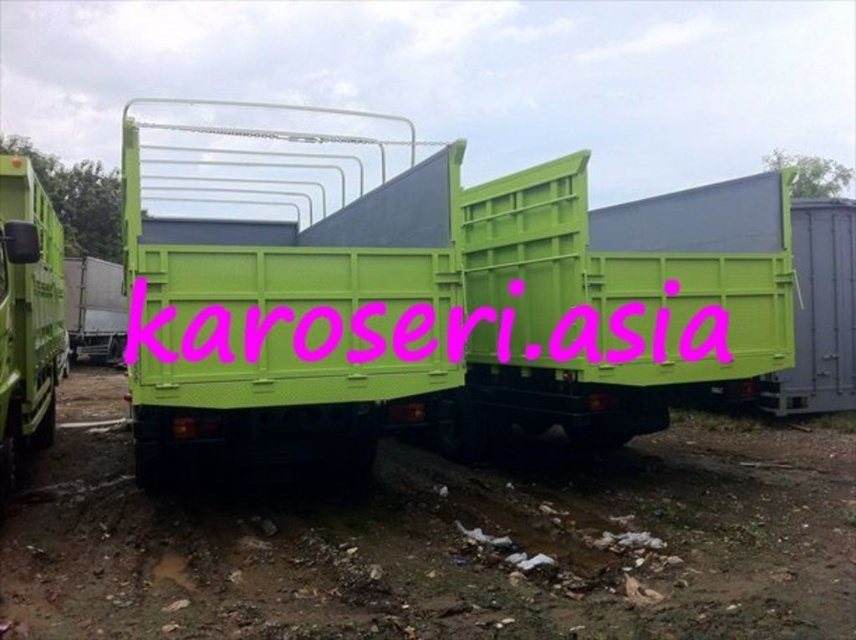
Is point (268, 278) closer to camera compared to point (116, 289)?

Yes, it is in front of point (116, 289).

Is point (334, 432) positioned after point (102, 360)?

No, (334, 432) is in front of (102, 360).

Where is `green matte truck at center`? green matte truck at center is located at coordinates tap(432, 305).